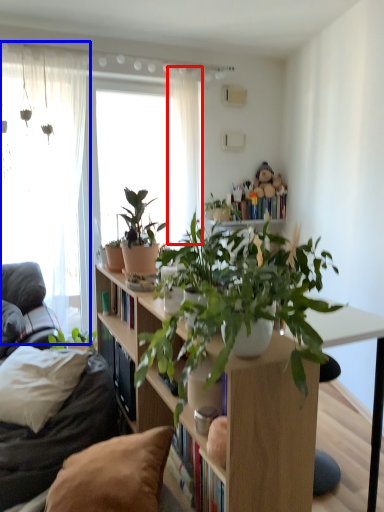
Question: Which of the following is the closest to the observer, curtain (highlighted by a red box) or window (highlighted by a blue box)?

Choices:
 (A) curtain
 (B) window

Answer: (B)